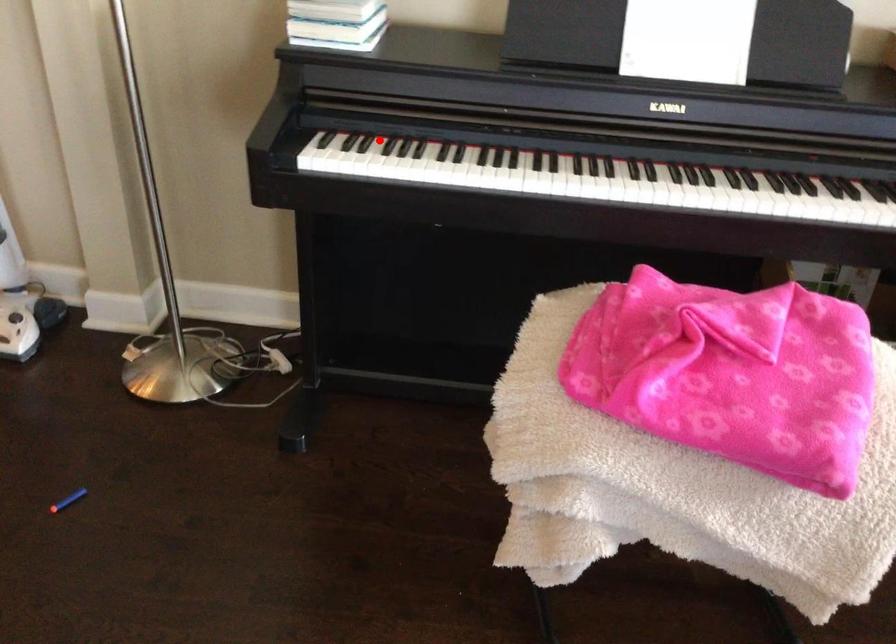
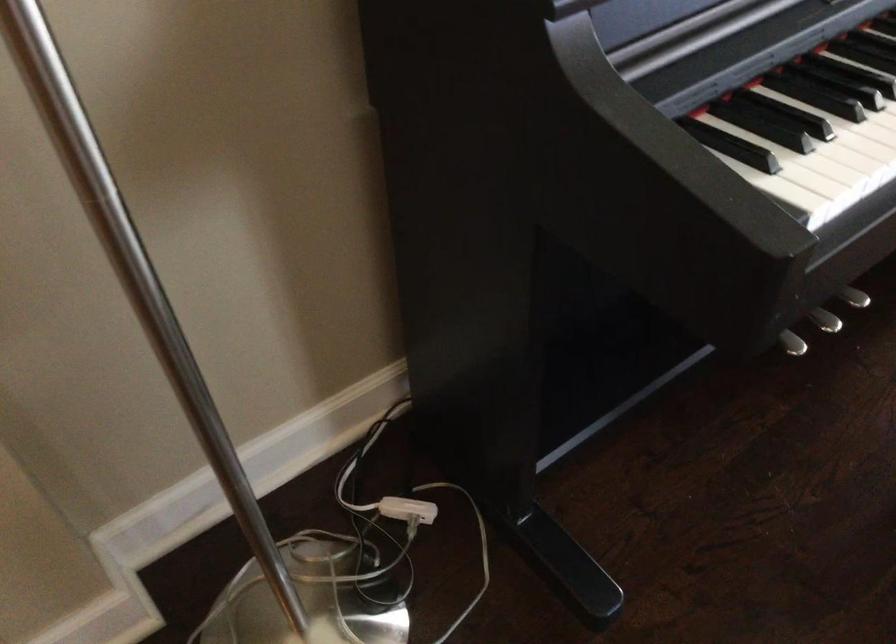
The point at the highlighted location is marked in the first image. Where is the corresponding point in the second image?

(799, 100)